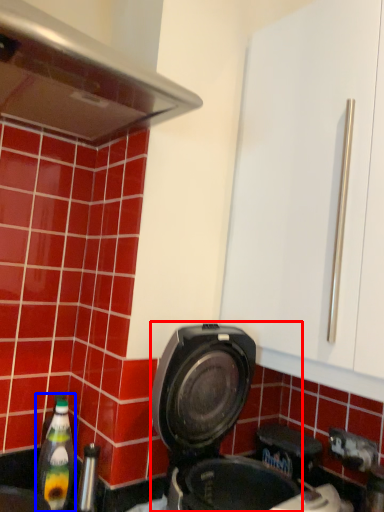
Question: Which of the following is the closest to the observer, kitchen appliance (highlighted by a red box) or bottle (highlighted by a blue box)?

Choices:
 (A) kitchen appliance
 (B) bottle

Answer: (A)